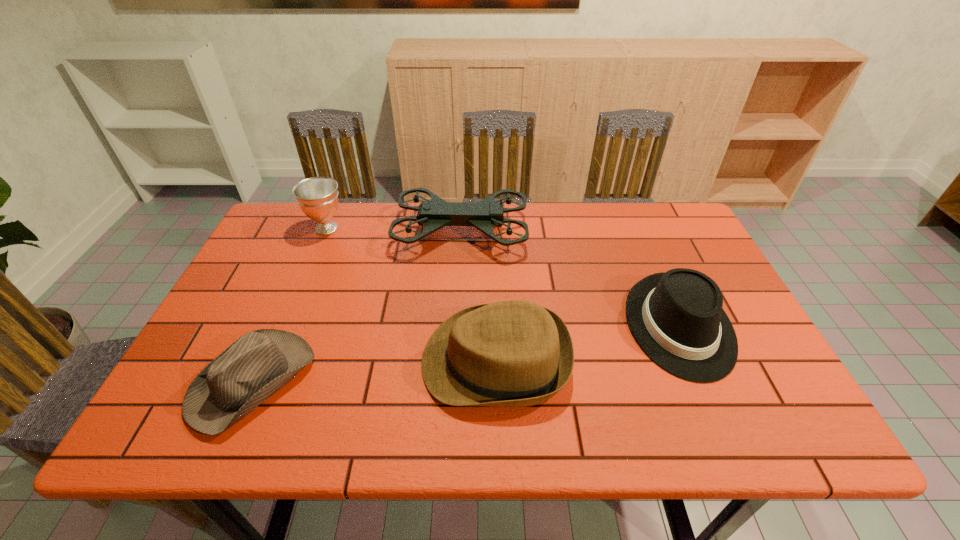
Where is `free region located 0.190m on the front-facing side of the second fedora from left to right`? This screenshot has height=540, width=960. free region located 0.190m on the front-facing side of the second fedora from left to right is located at coordinates (339, 361).

Locate an element on the screen. The image size is (960, 540). vacant region located on the front-facing side of the second fedora from left to right is located at coordinates (339, 361).

Where is `blank space located 0.060m on the right of the shortest object`? Image resolution: width=960 pixels, height=540 pixels. blank space located 0.060m on the right of the shortest object is located at coordinates (337, 381).

Find the location of a particular element. drone located in the far edge section of the desktop is located at coordinates (485, 215).

Identify the location of chalice that is positioned at the far edge. (317, 197).

Locate an element on the screen. The image size is (960, 540). chalice present at the left edge is located at coordinates (317, 197).

Find the location of `fedora present at the left edge`. fedora present at the left edge is located at coordinates click(255, 366).

Where is `object that is at the right edge`? object that is at the right edge is located at coordinates (676, 317).

Identify the location of object located at the far left corner. (317, 197).

What are the coordinates of `object that is at the near left corner` in the screenshot? It's located at (255, 366).